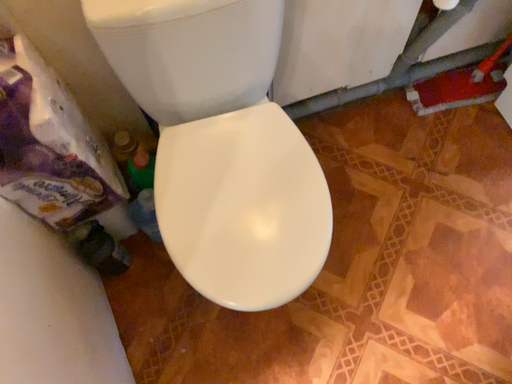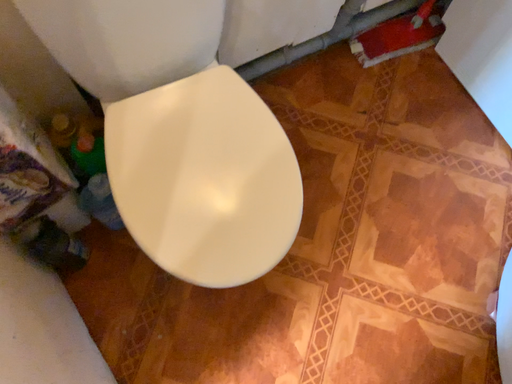
Question: Which way did the camera rotate in the video?

Choices:
 (A) rotated right
 (B) rotated left

Answer: (A)